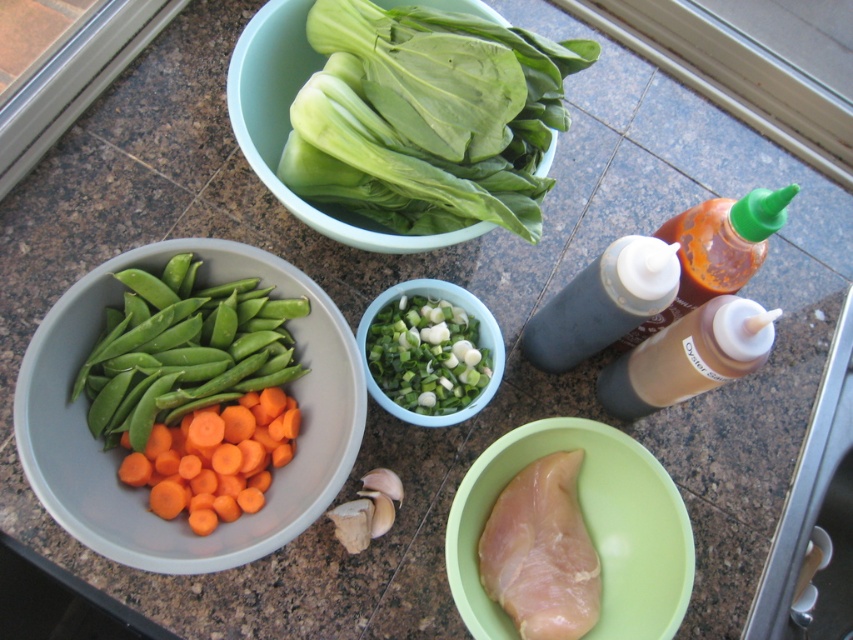
You are organizing ingredients on a kitchen counter and need to place a new spice jar between the pale green plastic at center and the orange smooth carrot at lower left. Based on their positions, where should you place the spice jar?

The pale green plastic at center is located below the orange smooth carrot at lower left, so you should place the spice jar between them by positioning it above the pale green plastic at center and below the orange smooth carrot at lower left.

You are organizing ingredients on a kitchen counter. You have a pale green plastic at center and an orange smooth carrot at lower left. Which object is positioned to the right of the other?

The pale green plastic at center is positioned to the right of the orange smooth carrot at lower left.